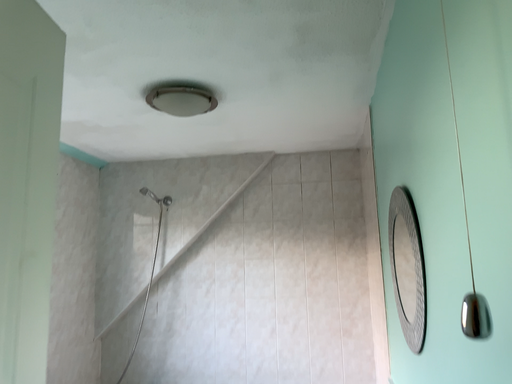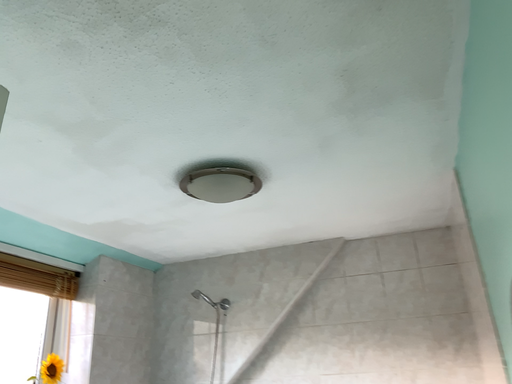
Question: How did the camera likely rotate when shooting the video?

Choices:
 (A) rotated right
 (B) rotated left

Answer: (B)